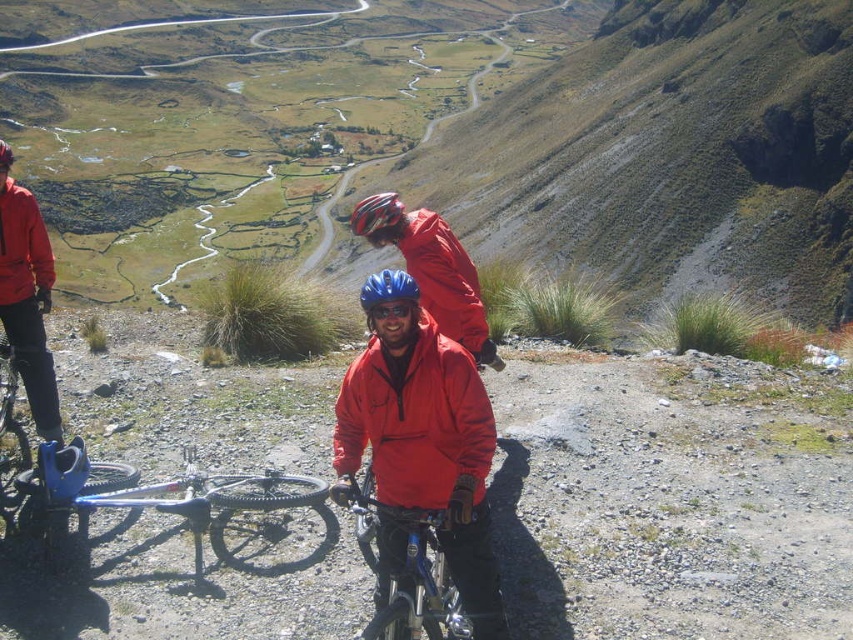
Question: Does blue metallic bicycle at center appear on the right side of blue matte bicycle helmet at center?

Choices:
 (A) yes
 (B) no

Answer: (A)

Question: Does matte red jacket at center have a lesser width compared to matte black helmet at center?

Choices:
 (A) no
 (B) yes

Answer: (B)

Question: Is matte red jacket at center bigger than matte black helmet at center?

Choices:
 (A) no
 (B) yes

Answer: (A)

Question: Which point is closer to the camera taking this photo?

Choices:
 (A) (383, 209)
 (B) (19, 483)
 (C) (395, 275)

Answer: (C)

Question: Estimate the real-world distances between objects in this image. Which object is closer to the blue metallic bicycle at center?

Choices:
 (A) blue reflective goggles at center
 (B) matte red jacket at center
 (C) blue metallic bicycle at lower left

Answer: (B)

Question: Which point is farther to the camera?

Choices:
 (A) matte red jacket at center
 (B) matte black helmet at center
 (C) blue metallic bicycle at lower left
 (D) blue reflective goggles at center

Answer: (B)